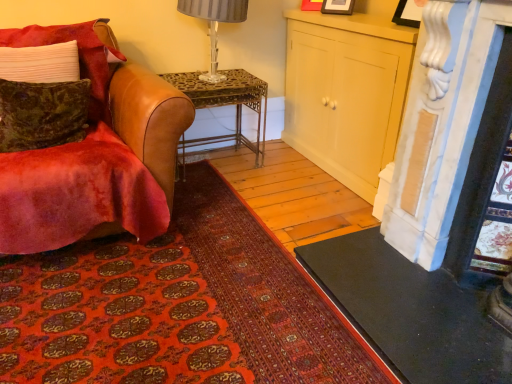
Question: Is velvet green pillow at left, which ranks as the 1th pillow in bottom-to-top order, aimed at velvet brown leather chair at left?

Choices:
 (A) yes
 (B) no

Answer: (A)

Question: Is velvet green pillow at left, which ranks as the 1th pillow in bottom-to-top order, located outside velvet brown leather chair at left?

Choices:
 (A) no
 (B) yes

Answer: (A)

Question: From a real-world perspective, is velvet green pillow at left, which ranks as the 2th pillow in top-to-bottom order, on velvet brown leather chair at left?

Choices:
 (A) yes
 (B) no

Answer: (A)

Question: Can you confirm if velvet green pillow at left, which ranks as the 1th pillow in bottom-to-top order, is smaller than velvet brown leather chair at left?

Choices:
 (A) yes
 (B) no

Answer: (A)

Question: From a real-world perspective, is velvet green pillow at left, which ranks as the 1th pillow in bottom-to-top order, positioned under velvet brown leather chair at left based on gravity?

Choices:
 (A) no
 (B) yes

Answer: (A)

Question: Is velvet green pillow at left, which ranks as the 1th pillow in bottom-to-top order, positioned in front of velvet brown leather chair at left?

Choices:
 (A) no
 (B) yes

Answer: (A)

Question: Considering the relative sizes of velvet green pillow at left, which ranks as the 1th pillow in bottom-to-top order, and matte cream cabinet at center in the image provided, is velvet green pillow at left, which ranks as the 1th pillow in bottom-to-top order, bigger than matte cream cabinet at center?

Choices:
 (A) yes
 (B) no

Answer: (B)

Question: Is matte cream cabinet at center at the back of velvet green pillow at left, which ranks as the 1th pillow in bottom-to-top order?

Choices:
 (A) no
 (B) yes

Answer: (A)

Question: From the image's perspective, is velvet green pillow at left, which ranks as the 2th pillow in top-to-bottom order, below matte cream cabinet at center?

Choices:
 (A) yes
 (B) no

Answer: (A)

Question: Can you confirm if velvet green pillow at left, which ranks as the 1th pillow in bottom-to-top order, is wider than matte cream cabinet at center?

Choices:
 (A) yes
 (B) no

Answer: (B)

Question: Is velvet green pillow at left, which ranks as the 2th pillow in top-to-bottom order, closer to the viewer compared to matte cream cabinet at center?

Choices:
 (A) no
 (B) yes

Answer: (B)

Question: Is velvet green pillow at left, which ranks as the 2th pillow in top-to-bottom order, facing towards matte cream cabinet at center?

Choices:
 (A) yes
 (B) no

Answer: (B)

Question: Considering the relative sizes of velvet green pillow at left, arranged as the first pillow when viewed from the top, and metallic wrought iron desk at center in the image provided, is velvet green pillow at left, arranged as the first pillow when viewed from the top, bigger than metallic wrought iron desk at center?

Choices:
 (A) no
 (B) yes

Answer: (A)